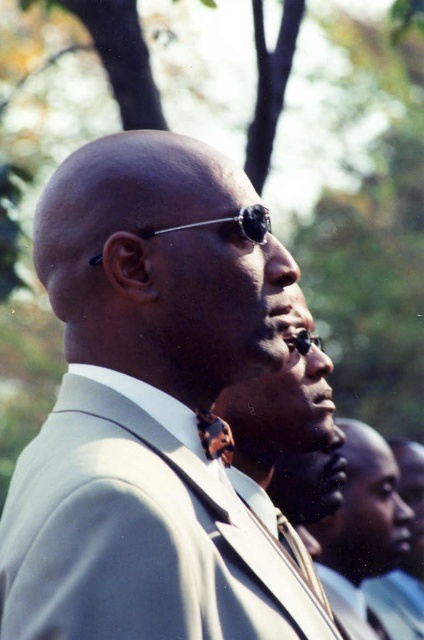
Based on the photo, is the position of matte black suit at center less distant than that of dark brown leather tie at center?

No.

Does matte black suit at center appear under dark brown leather tie at center?

Yes.

Who is more forward, (331, 556) or (233, 452)?

Point (233, 452) is more forward.

At what (x,y) coordinates should I click in order to perform the action: click on matte black suit at center. Please return your answer as a coordinate pair (x, y). The width and height of the screenshot is (424, 640). Looking at the image, I should click on (363, 532).

Is point (119, 365) closer to viewer compared to point (345, 506)?

Yes, point (119, 365) is closer to viewer.

Between point (117, 472) and point (379, 467), which one is positioned behind?

Point (379, 467)

What do you see at coordinates (150, 406) in the screenshot?
I see `gray matte suit at center` at bounding box center [150, 406].

Find the location of a particular element. This screenshot has width=424, height=640. gray matte suit at center is located at coordinates (150, 406).

Is gray matte suit at center thinner than dark brown leather tie at center?

No.

Does gray matte suit at center have a smaller size compared to dark brown leather tie at center?

Actually, gray matte suit at center might be larger than dark brown leather tie at center.

Does point (117, 257) come closer to viewer compared to point (226, 428)?

That is True.

Locate an element on the screen. gray matte suit at center is located at coordinates (150, 406).